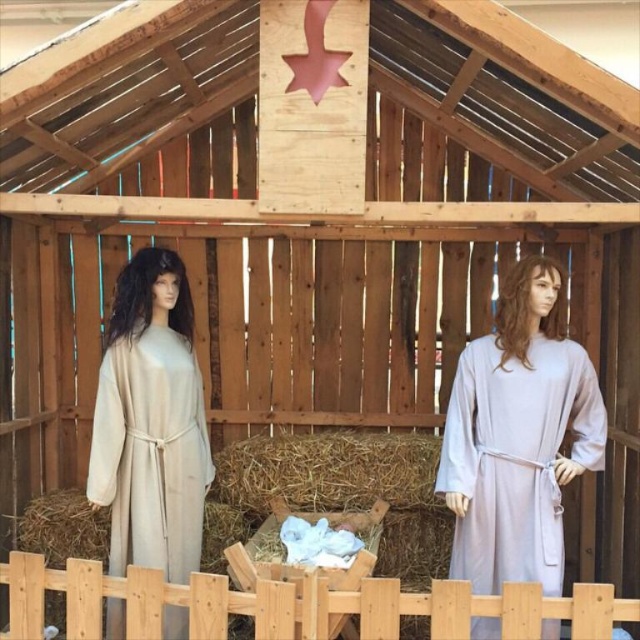
This screenshot has height=640, width=640. Identify the location of beige fabric dress at left. (150, 420).

Based on the photo, between beige fabric dress at left and light purple fabric dress at right, which one has more height?

Standing taller between the two is beige fabric dress at left.

Identify the location of beige fabric dress at left. The image size is (640, 640). (150, 420).

Is point (170, 314) positioned after point (525, 618)?

That is True.

What do you see at coordinates (150, 420) in the screenshot? I see `beige fabric dress at left` at bounding box center [150, 420].

What do you see at coordinates (150, 420) in the screenshot?
I see `beige fabric dress at left` at bounding box center [150, 420].

I want to click on beige fabric dress at left, so click(150, 420).

Is light purple fabric dress at right further to the viewer compared to wooden fence at lower center?

Yes, light purple fabric dress at right is behind wooden fence at lower center.

Is light purple fabric dress at right smaller than wooden fence at lower center?

Yes, light purple fabric dress at right is smaller than wooden fence at lower center.

Is point (566, 410) more distant than point (262, 624)?

Yes, it is.

At what (x,y) coordinates should I click in order to perform the action: click on light purple fabric dress at right. Please return your answer as a coordinate pair (x, y). The image size is (640, 640). Looking at the image, I should click on (515, 458).